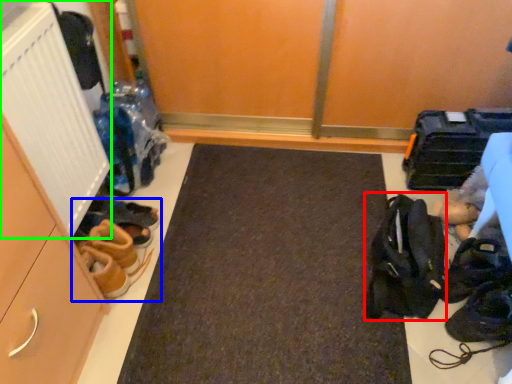
Question: Estimate the real-world distances between objects in this image. Which object is closer to accessory (highlighted by a red box), footwear (highlighted by a blue box) or radiator (highlighted by a green box)?

Choices:
 (A) footwear
 (B) radiator

Answer: (A)